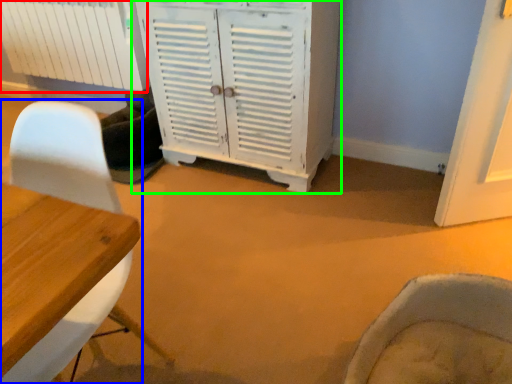
Question: Which object is positioned closest to radiator (highlighted by a red box)? Select from chair (highlighted by a blue box) and cabinetry (highlighted by a green box).

Choices:
 (A) chair
 (B) cabinetry

Answer: (B)